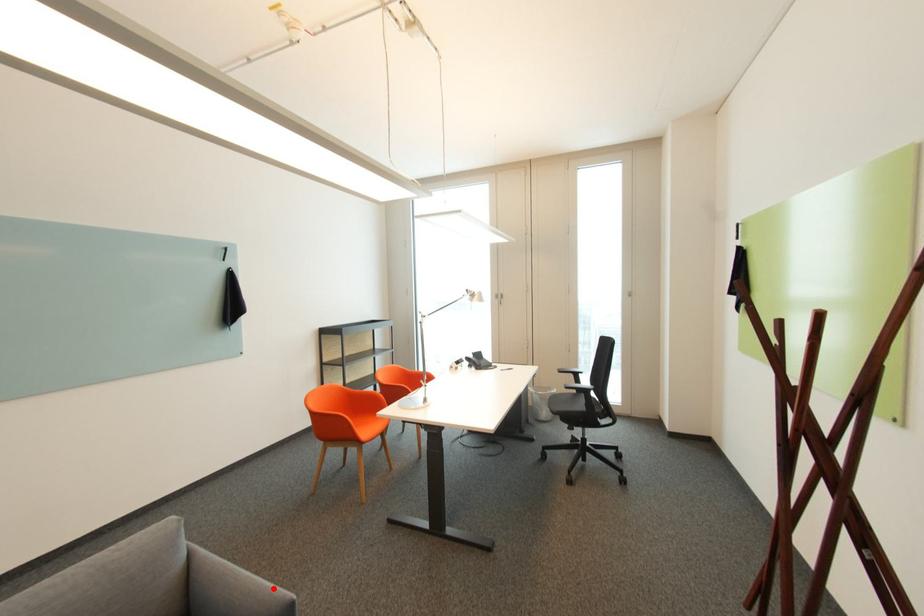
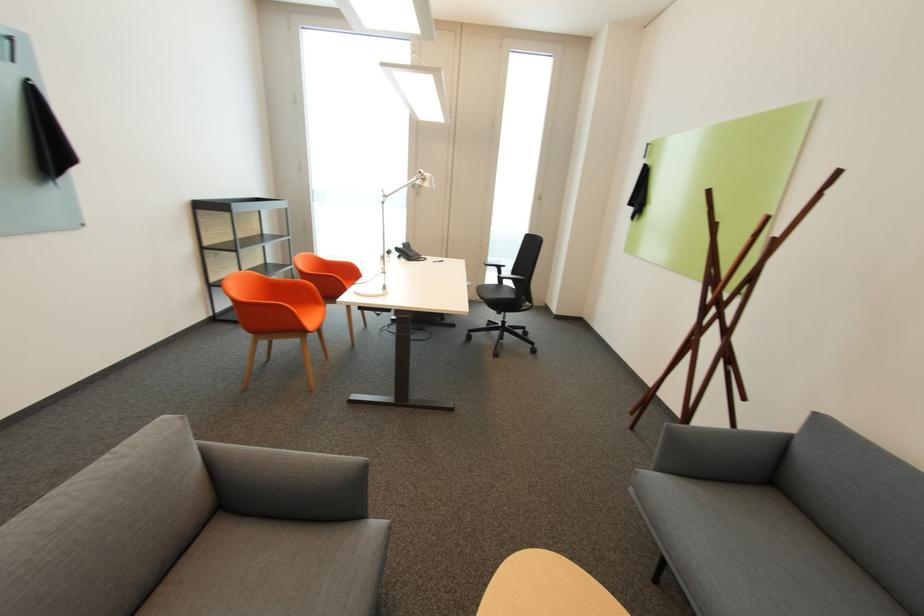
Question: A red point is marked in image1. In image2, is the corresponding 3D point closer to the camera or farther? Reply with the corresponding letter.

Choices:
 (A) The corresponding 3D point is closer.
 (B) The corresponding 3D point is farther.

Answer: (A)